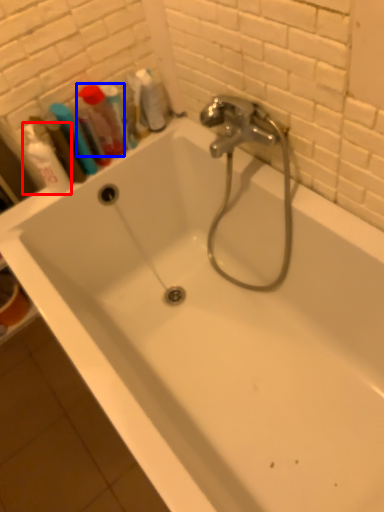
Question: Which object appears farthest to the camera in this image, shaving cream (highlighted by a red box) or mouthwash (highlighted by a blue box)?

Choices:
 (A) shaving cream
 (B) mouthwash

Answer: (B)